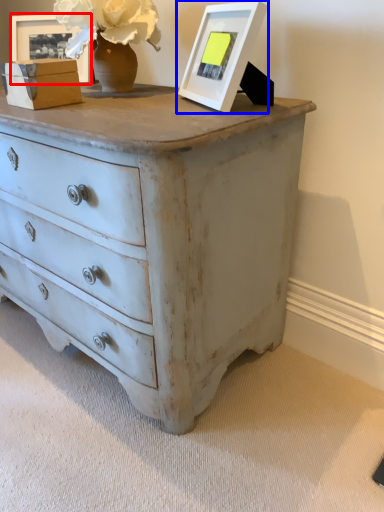
Question: Which object appears closest to the camera in this image, picture frame (highlighted by a red box) or picture frame (highlighted by a blue box)?

Choices:
 (A) picture frame
 (B) picture frame

Answer: (B)